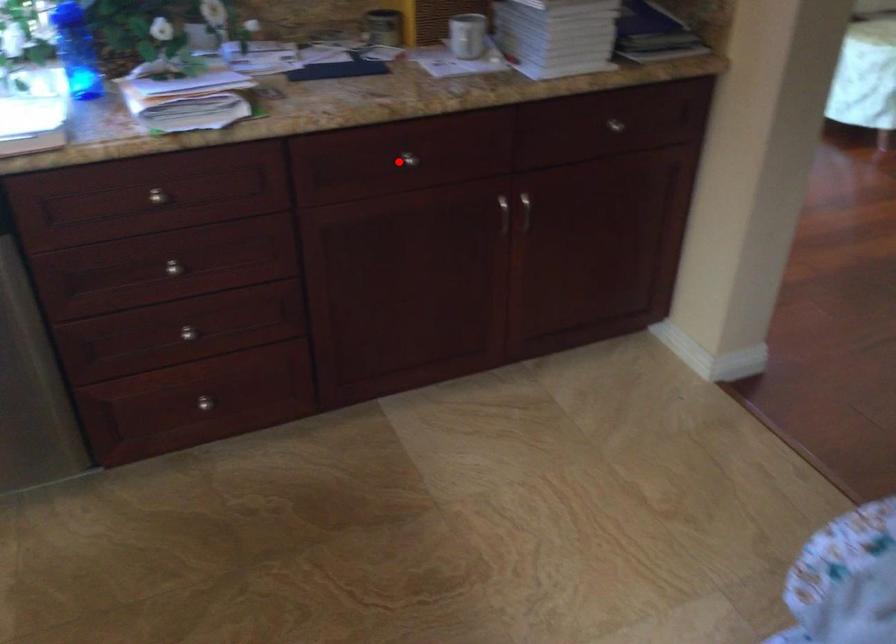
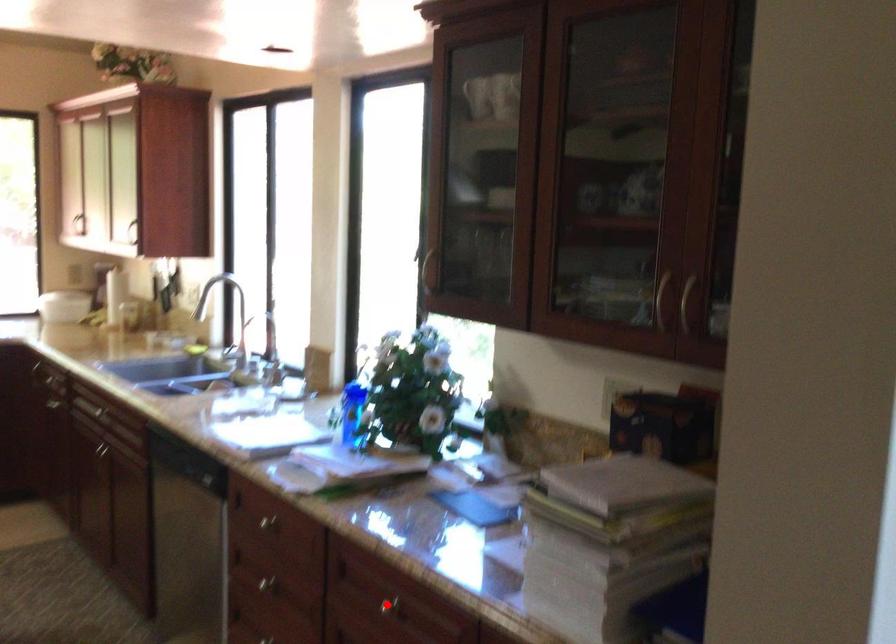
I am providing you with two images of the same scene from different viewpoints. A red point is marked on the first image and another point is marked on the second image. Do the highlighted points in image1 and image2 indicate the same real-world spot?

Yes